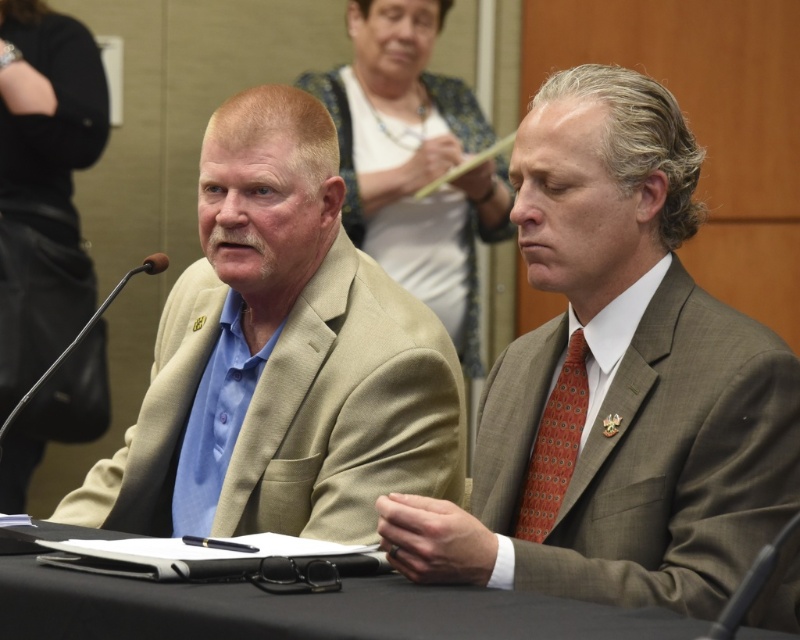
Describe the element at coordinates (616, 381) in the screenshot. I see `matte brown suit at center` at that location.

Between point (658, 541) and point (281, 211), which one is positioned behind?

The point (281, 211) is more distant.

Between point (590, 540) and point (348, 496), which one is positioned behind?

The point (348, 496) is behind.

Locate an element on the screen. Image resolution: width=800 pixels, height=640 pixels. matte brown suit at center is located at coordinates (616, 381).

Describe the element at coordinates (280, 356) in the screenshot. Image resolution: width=800 pixels, height=640 pixels. I see `beige fabric suit at left` at that location.

At what (x,y) coordinates should I click in order to perform the action: click on beige fabric suit at left. Please return your answer as a coordinate pair (x, y). Looking at the image, I should click on (280, 356).

In the scene shown: Who is shorter, matte brown suit at center or black fabric table at center?

black fabric table at center is shorter.

Can you confirm if matte brown suit at center is taller than black fabric table at center?

Yes.

Who is more forward, (568,104) or (644,627)?

Point (644,627)

This screenshot has width=800, height=640. In order to click on matte brown suit at center in this screenshot , I will do `click(616, 381)`.